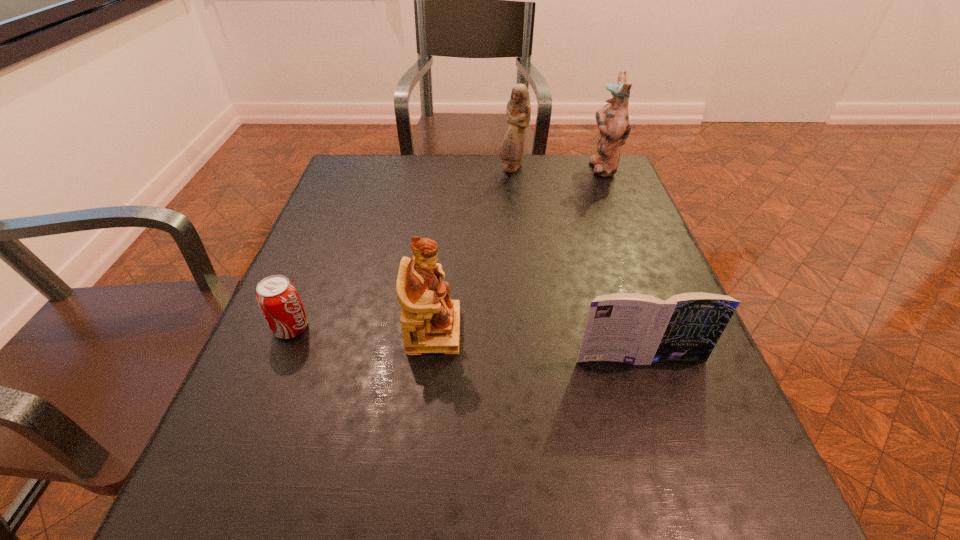
This screenshot has height=540, width=960. In order to click on free space at the left edge in this screenshot , I will do `click(309, 349)`.

In the image, there is a desktop. Where is `vacant space at the right edge`? The height and width of the screenshot is (540, 960). vacant space at the right edge is located at coordinates (607, 200).

Where is `free region at the far left corner of the desktop`? Image resolution: width=960 pixels, height=540 pixels. free region at the far left corner of the desktop is located at coordinates (379, 170).

Identify the location of blank area at the far right corner. (576, 157).

Where is `vacant point located between the fourth object from right to left and the leftmost object`? The image size is (960, 540). vacant point located between the fourth object from right to left and the leftmost object is located at coordinates (363, 329).

What are the coordinates of `blank region between the leftmost figurine and the second shortest object` in the screenshot? It's located at (538, 345).

Locate an element on the screen. The height and width of the screenshot is (540, 960). unoccupied position between the second shortest object and the rightmost figurine is located at coordinates (621, 263).

You are a GUI agent. You are given a task and a screenshot of the screen. Output one action in this format:
    pyautogui.click(x=<x>, y=<y>)
    Task: Click on the vacant space in between the book and the rightmost figurine
    
    Given the screenshot: What is the action you would take?
    pyautogui.click(x=621, y=263)

Where is `unoccupied area between the rightmost figurine and the second figurine from right to left`? This screenshot has width=960, height=540. unoccupied area between the rightmost figurine and the second figurine from right to left is located at coordinates (557, 168).

Where is `free space between the third object from right to left and the soda`? free space between the third object from right to left and the soda is located at coordinates (401, 248).